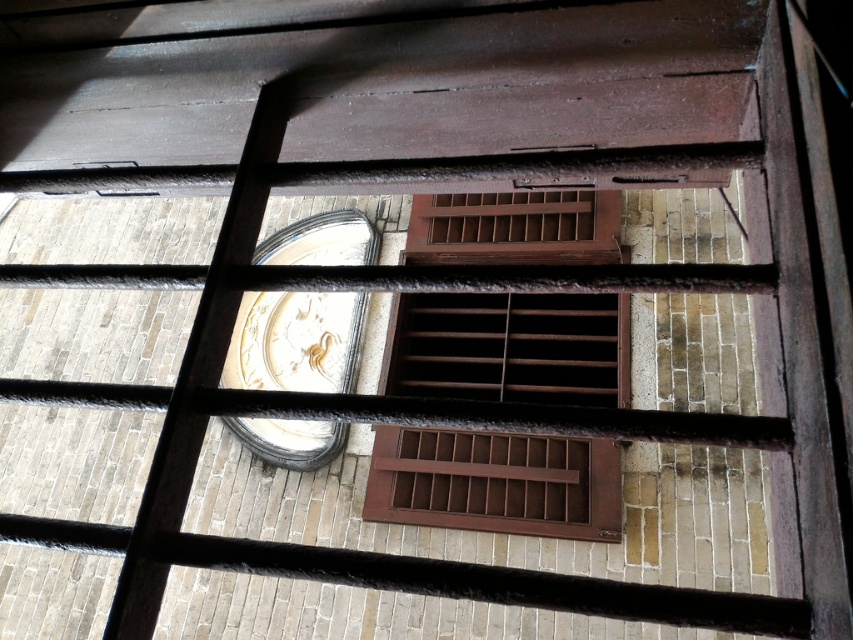
Question: Can you confirm if brown wooden window at center is positioned to the left of gold metallic clock at center-left?

Choices:
 (A) no
 (B) yes

Answer: (A)

Question: From the image, what is the correct spatial relationship of brown wooden window at center in relation to gold metallic clock at center-left?

Choices:
 (A) left
 (B) right

Answer: (B)

Question: Which object is closer to the camera taking this photo?

Choices:
 (A) brown wooden window at center
 (B) gold metallic clock at center-left

Answer: (A)

Question: From the image, what is the correct spatial relationship of brown wooden window at center in relation to gold metallic clock at center-left?

Choices:
 (A) below
 (B) above

Answer: (B)